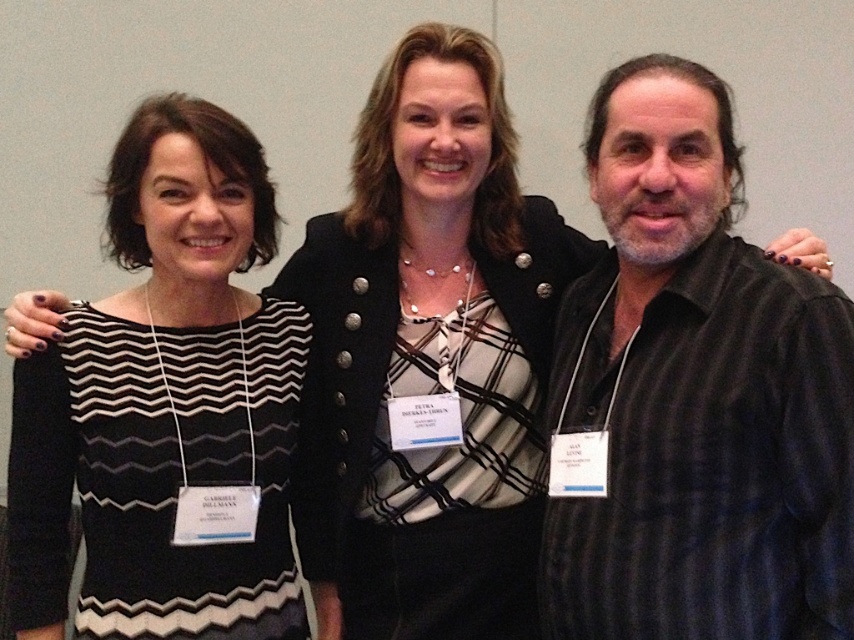
Question: Is black striped shirt at right to the left of black striped dress at left from the viewer's perspective?

Choices:
 (A) no
 (B) yes

Answer: (A)

Question: Which of the following is the farthest from the observer?

Choices:
 (A) (117, 314)
 (B) (559, 582)

Answer: (A)

Question: Which object is closer to the camera taking this photo?

Choices:
 (A) black striped shirt at right
 (B) black striped dress at left

Answer: (A)

Question: Can you confirm if black striped shirt at right is wider than black striped dress at left?

Choices:
 (A) no
 (B) yes

Answer: (A)

Question: Where is black striped shirt at right located in relation to black striped dress at left in the image?

Choices:
 (A) right
 (B) left

Answer: (A)